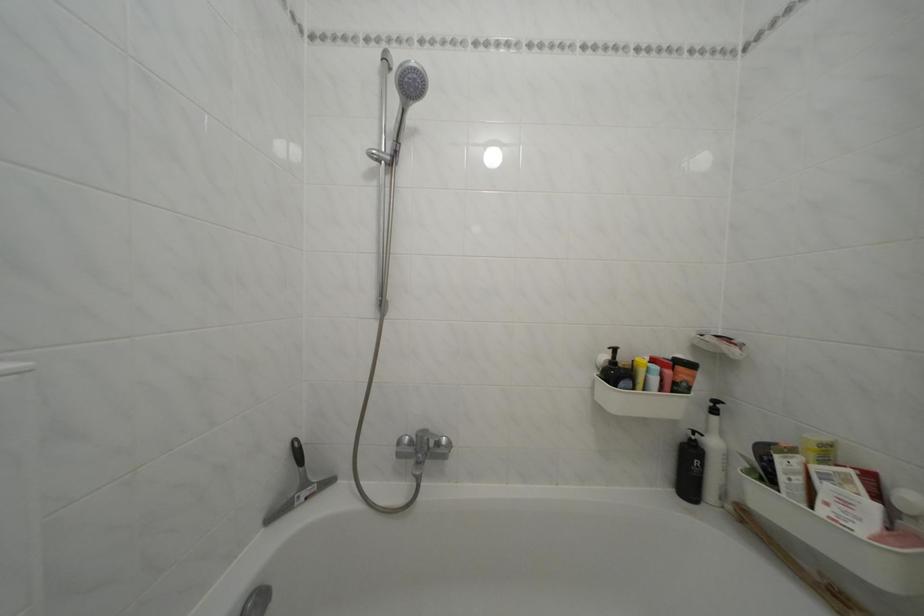
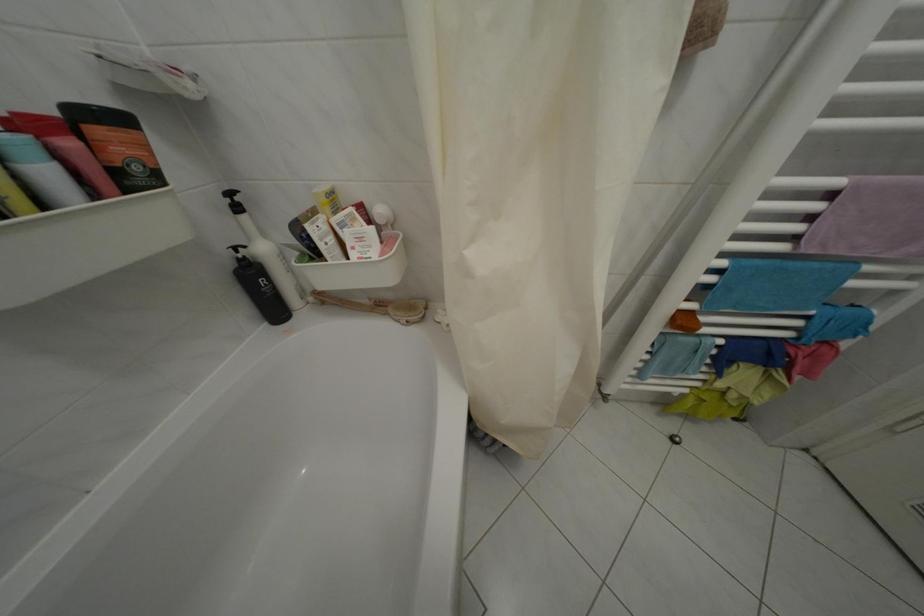
Based on the continuous images, in which direction is the camera rotating?

The rotation direction of the camera is right-down.